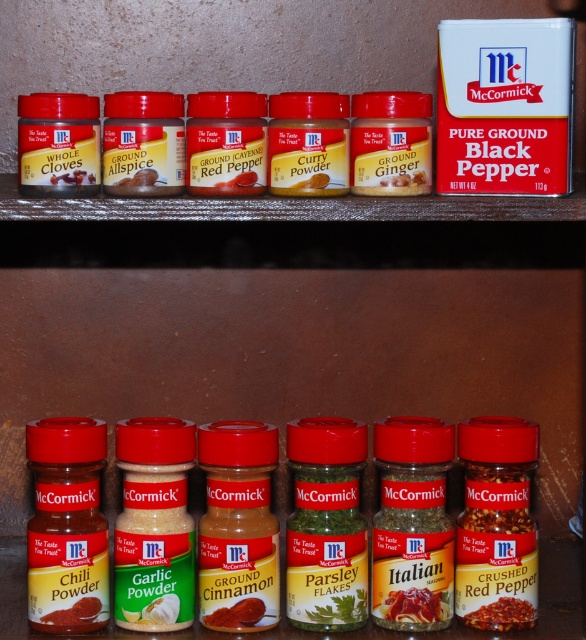
Can you confirm if ground cinnamon at center is taller than whole cloves at upper left?

Yes.

Find the location of `ground cinnamon at center`. ground cinnamon at center is located at coordinates (236, 612).

Is red matte spice bottles at center positioned at the back of yellowish-brown powder ginger at center?

That is False.

Is red matte spice bottles at center bigger than yellowish-brown powder ginger at center?

Indeed, red matte spice bottles at center has a larger size compared to yellowish-brown powder ginger at center.

Does point (96, 484) lie behind point (397, 177)?

Yes, point (96, 484) is behind point (397, 177).

This screenshot has height=640, width=586. What are the coordinates of `red matte spice bottles at center` in the screenshot? It's located at point(328,516).

This screenshot has width=586, height=640. Describe the element at coordinates (236, 612) in the screenshot. I see `ground cinnamon at center` at that location.

Between ground cinnamon at center and yellowish matte curry powder at center, which one appears on the left side from the viewer's perspective?

ground cinnamon at center

Between point (224, 612) and point (321, 176), which one is positioned in front?

Point (224, 612)

Locate an element on the screen. The width and height of the screenshot is (586, 640). ground cinnamon at center is located at coordinates (236, 612).